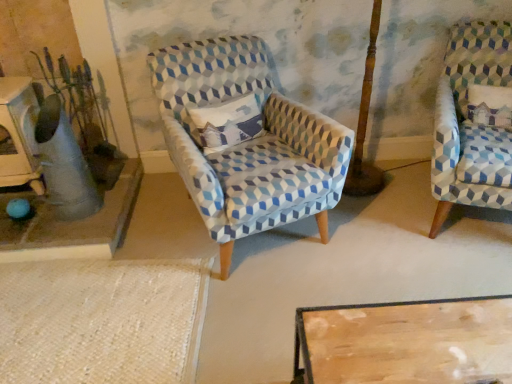
Image resolution: width=512 pixels, height=384 pixels. Find the location of `vacant space to the right of matte gray concrete table at left`. vacant space to the right of matte gray concrete table at left is located at coordinates (174, 226).